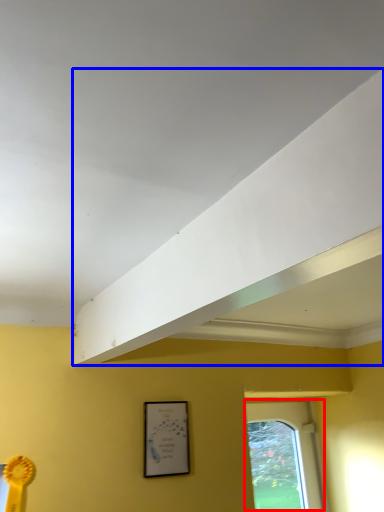
Question: Which point is closer to the camera, window (highlighted by a red box) or exhaust hood (highlighted by a blue box)?

Choices:
 (A) window
 (B) exhaust hood

Answer: (B)